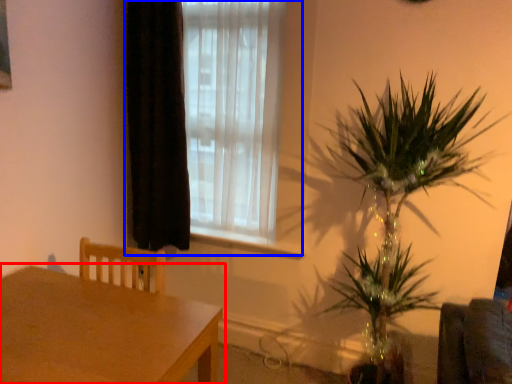
Question: Among these objects, which one is farthest to the camera, table (highlighted by a red box) or window (highlighted by a blue box)?

Choices:
 (A) table
 (B) window

Answer: (B)